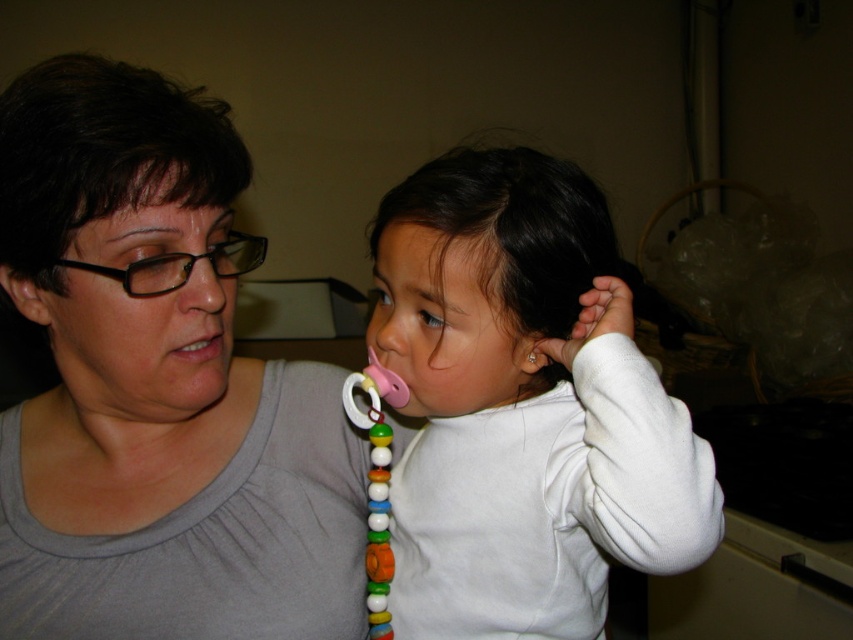
Looking at the scene described, which object is positioned to the left of the other between the matte skin mouth at center and the pink plastic teething ring at center?

The matte skin mouth at center is positioned to the left of the pink plastic teething ring at center.

You are a pediatrician assessing the safety of the pacifier for the child. Based on the image, is the pink rubber pacifier at center too big to fit inside the matte skin mouth at center?

The pink rubber pacifier at center is larger in size than the matte skin mouth at center, so it is too big to fit safely inside the matte skin mouth at center.

You are standing in the kitchen scene and want to place a small decoration between the two points labeled point (4,300) and point (526,356). Given that the decoration needs to be placed in front of the point that is further back, which point should the decoration be placed in front of?

The decoration should be placed in front of point (4,300) because it is behind point (526,356), making it the further back point.